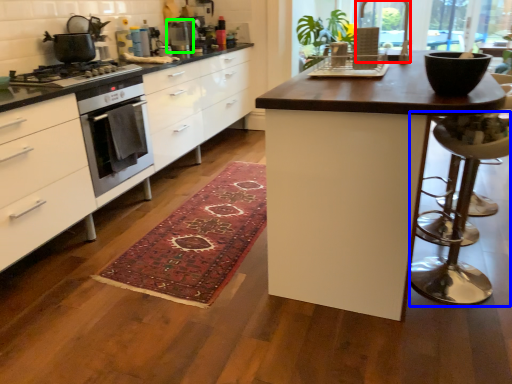
Question: Based on their relative distances, which object is nearer to window screen (highlighted by a red box)? Choose from bar stool (highlighted by a blue box) and appliance (highlighted by a green box).

Choices:
 (A) bar stool
 (B) appliance

Answer: (A)